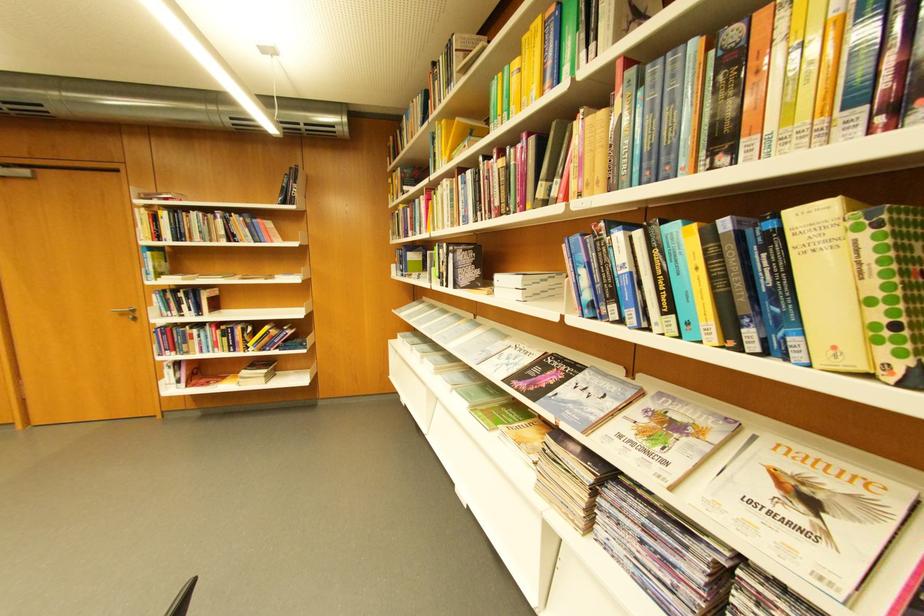
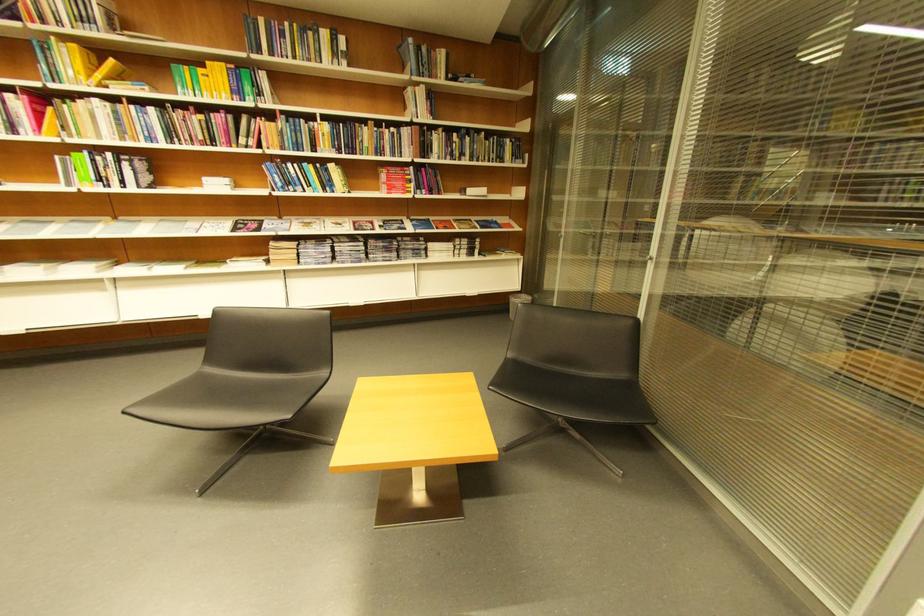
Locate, in the second image, the point that corresponds to (598,298) in the first image.

(290, 185)